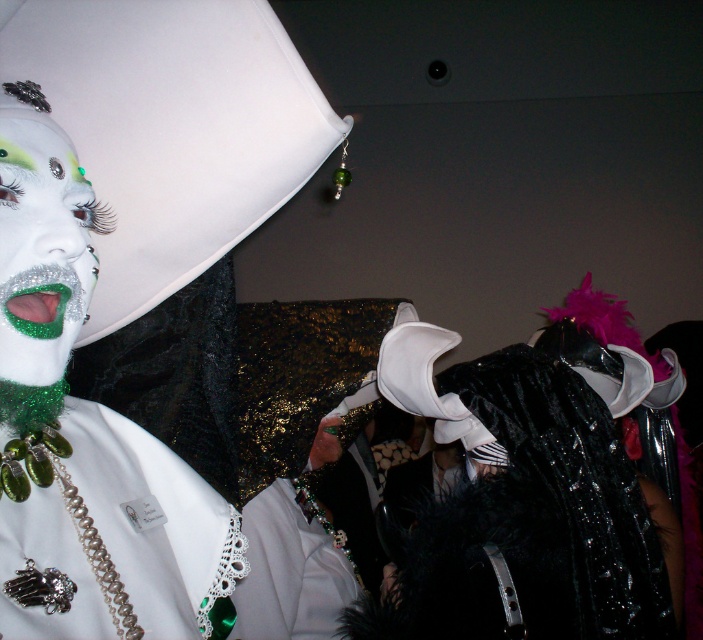
Question: Which point is farther to the camera?

Choices:
 (A) green glittery lips at left
 (B) white lace collar at center
 (C) silver/glass beads necklace at lower left

Answer: (B)

Question: Considering the real-world distances, which object is farthest from the glittery green lips at center?

Choices:
 (A) green glittery lips at left
 (B) shiny black cape at center

Answer: (B)

Question: Which of these objects is positioned closest to the silver/glass beads necklace at lower left?

Choices:
 (A) green glittery lips at left
 (B) shiny black cape at center
 (C) green glittering necklace at center

Answer: (C)

Question: Observing the image, what is the correct spatial positioning of matte white mask at left in reference to green glittering necklace at center?

Choices:
 (A) above
 (B) below

Answer: (A)

Question: Is green glittering necklace at center thinner than green glittery lips at left?

Choices:
 (A) yes
 (B) no

Answer: (B)

Question: Does matte white mask at left have a larger size compared to silver/glass beads necklace at lower left?

Choices:
 (A) no
 (B) yes

Answer: (B)